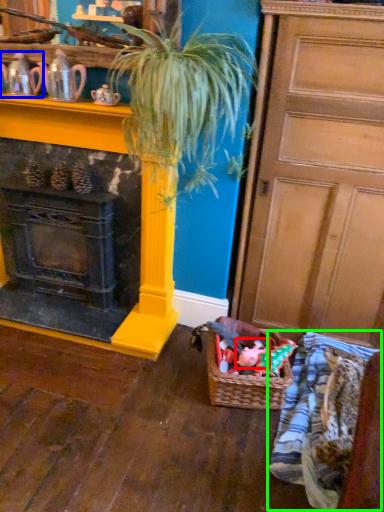
Question: Estimate the real-world distances between objects in this image. Which object is closer to toy (highlighted by a red box), tea pot (highlighted by a blue box) or clothing (highlighted by a green box)?

Choices:
 (A) tea pot
 (B) clothing

Answer: (B)